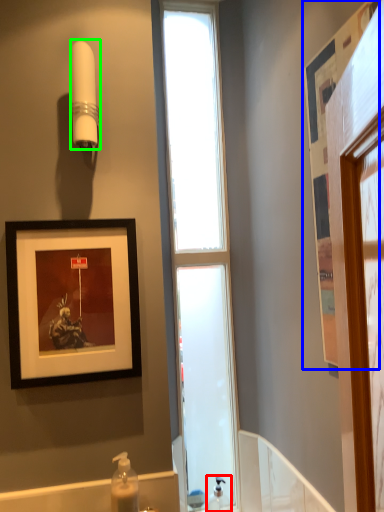
Question: Which is nearer to the soap dispenser (highlighted by a red box)? picture frame (highlighted by a blue box) or shower (highlighted by a green box).

Choices:
 (A) picture frame
 (B) shower

Answer: (A)